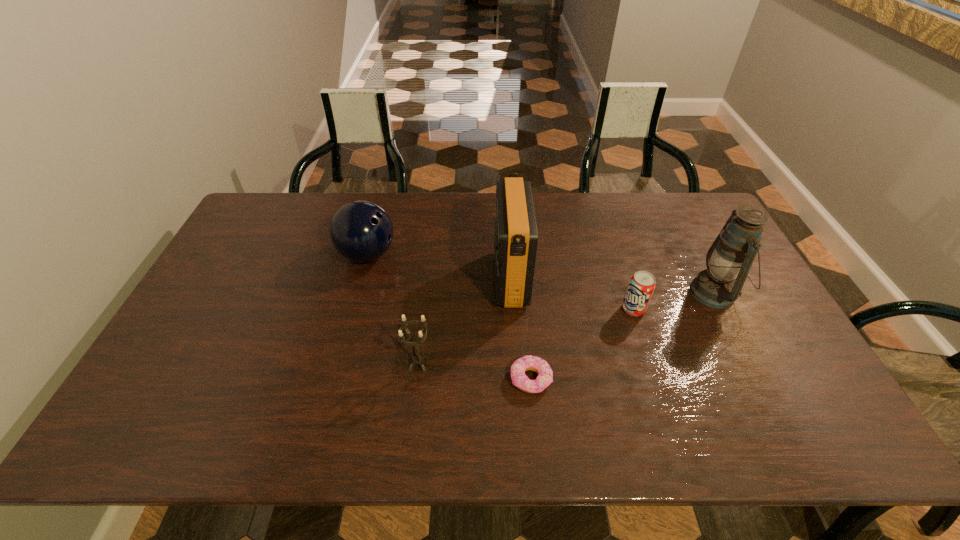
Select which object appears as the fifth closest to the candle holder. Please provide its 2D coordinates. Your answer should be formatted as a tuple, i.e. [(x, y)], where the tuple contains the x and y coordinates of a point satisfying the conditions above.

[(730, 257)]

Locate an element on the screen. the second closest object to the oil lamp is located at coordinates (545, 374).

Find the location of a particular element. The width and height of the screenshot is (960, 540). vacant position in the image that satisfies the following two spatial constraints: 1. on the surface of the bowling ball near the finger holes; 2. on the back side of the oil lamp is located at coordinates (357, 293).

Image resolution: width=960 pixels, height=540 pixels. Identify the location of vacant space that satisfies the following two spatial constraints: 1. on the surface of the soda can near the finger holes; 2. on the right side of the bowling ball. (352, 309).

Where is `vacant area that satisfies the following two spatial constraints: 1. on the front-facing side of the radio receiver; 2. on the left side of the rightmost object`? The image size is (960, 540). vacant area that satisfies the following two spatial constraints: 1. on the front-facing side of the radio receiver; 2. on the left side of the rightmost object is located at coordinates (511, 293).

What are the coordinates of `vacant position in the image that satisfies the following two spatial constraints: 1. on the surface of the leftmost object near the finger holes; 2. on the right side of the third shortest object` in the screenshot? It's located at (338, 364).

What are the coordinates of `free space in the image that satisfies the following two spatial constraints: 1. on the front side of the doughnut; 2. on the right side of the fourth tallest object` in the screenshot? It's located at (417, 379).

I want to click on free point that satisfies the following two spatial constraints: 1. on the back side of the oil lamp; 2. on the surface of the leftmost object near the finger holes, so point(695,255).

Find the location of a particular element. The height and width of the screenshot is (540, 960). vacant space that satisfies the following two spatial constraints: 1. on the back side of the doughnut; 2. on the front-facing side of the radio receiver is located at coordinates (521, 279).

The height and width of the screenshot is (540, 960). I want to click on free space that satisfies the following two spatial constraints: 1. on the surface of the leftmost object near the finger holes; 2. on the back side of the rightmost object, so click(x=357, y=293).